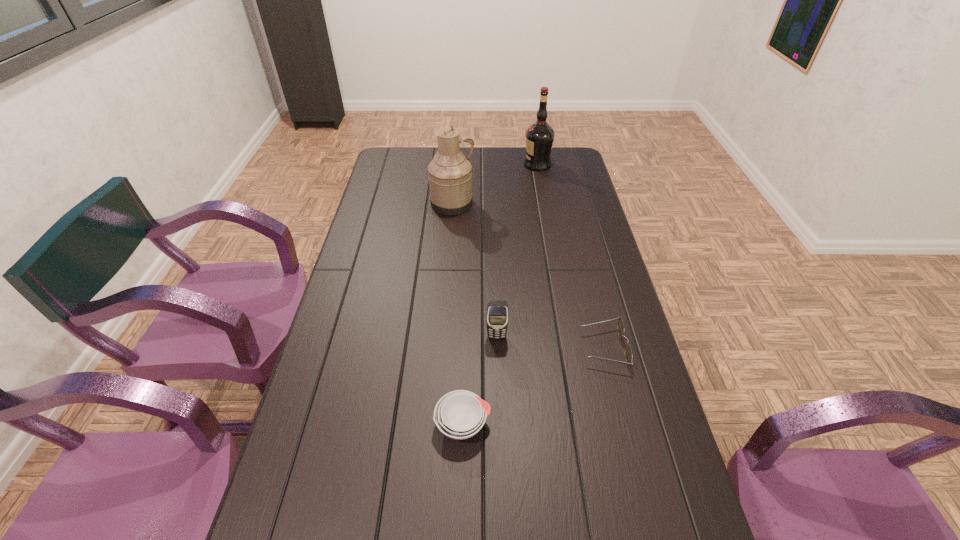
Where is `vacant space at the right edge`? The height and width of the screenshot is (540, 960). vacant space at the right edge is located at coordinates (652, 406).

Find the location of a particular element. The height and width of the screenshot is (540, 960). free space between the third shortest object and the soup bowl is located at coordinates (480, 381).

Locate an element on the screen. Image resolution: width=960 pixels, height=540 pixels. free space that is in between the spectacles and the nearest object is located at coordinates (534, 386).

You are a GUI agent. You are given a task and a screenshot of the screen. Output one action in this format:
    pyautogui.click(x=<x>, y=<y>)
    Task: Click on the free spot between the spectacles and the pitcher
    The width and height of the screenshot is (960, 540).
    Given the screenshot: What is the action you would take?
    coord(528,276)

Locate an element on the screen. This screenshot has height=540, width=960. unoccupied position between the liquor and the spectacles is located at coordinates (570, 256).

Where is `free spot between the third shortest object and the pitcher`? This screenshot has width=960, height=540. free spot between the third shortest object and the pitcher is located at coordinates (474, 270).

Where is `empty space that is in between the liquor and the nearest object`? The image size is (960, 540). empty space that is in between the liquor and the nearest object is located at coordinates (500, 294).

Identify the location of blank region between the soup bowl and the farthest object. (500, 294).

This screenshot has width=960, height=540. Find the location of `unoccupied area between the pitcher and the farthest object`. unoccupied area between the pitcher and the farthest object is located at coordinates (495, 184).

You are a GUI agent. You are given a task and a screenshot of the screen. Output one action in this format:
    pyautogui.click(x=<x>, y=<y>)
    Task: Click on the vacant space that's between the liquor and the third tallest object
    
    Given the screenshot: What is the action you would take?
    pyautogui.click(x=517, y=251)